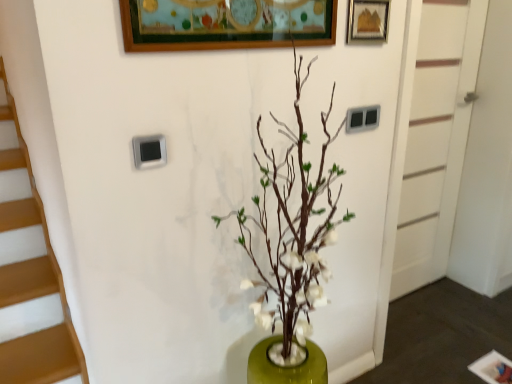
Question: Is green matte vase at center behind wooden picture frame at upper right?

Choices:
 (A) yes
 (B) no

Answer: (B)

Question: Considering the relative sizes of green matte vase at center and wooden picture frame at upper right in the image provided, is green matte vase at center taller than wooden picture frame at upper right?

Choices:
 (A) no
 (B) yes

Answer: (B)

Question: From a real-world perspective, does green matte vase at center sit lower than wooden picture frame at upper right?

Choices:
 (A) no
 (B) yes

Answer: (B)

Question: Is green matte vase at center positioned before wooden picture frame at upper right?

Choices:
 (A) yes
 (B) no

Answer: (A)

Question: Would you say green matte vase at center is a long distance from wooden picture frame at upper right?

Choices:
 (A) no
 (B) yes

Answer: (A)

Question: Is green matte vase at center to the right of wooden picture frame at upper right from the viewer's perspective?

Choices:
 (A) yes
 (B) no

Answer: (B)

Question: Is wooden picture frame at upper right at the right side of white painted wood door at right?

Choices:
 (A) no
 (B) yes

Answer: (A)

Question: Is wooden picture frame at upper right turned away from white painted wood door at right?

Choices:
 (A) no
 (B) yes

Answer: (A)

Question: Does wooden picture frame at upper right have a smaller size compared to white painted wood door at right?

Choices:
 (A) yes
 (B) no

Answer: (A)

Question: Would you say wooden picture frame at upper right contains white painted wood door at right?

Choices:
 (A) no
 (B) yes

Answer: (A)

Question: From the image's perspective, would you say wooden picture frame at upper right is positioned over white painted wood door at right?

Choices:
 (A) no
 (B) yes

Answer: (B)

Question: Is wooden picture frame at upper right far away from white painted wood door at right?

Choices:
 (A) no
 (B) yes

Answer: (B)

Question: Is green matte vase at center further to camera compared to white painted wood door at right?

Choices:
 (A) no
 (B) yes

Answer: (A)